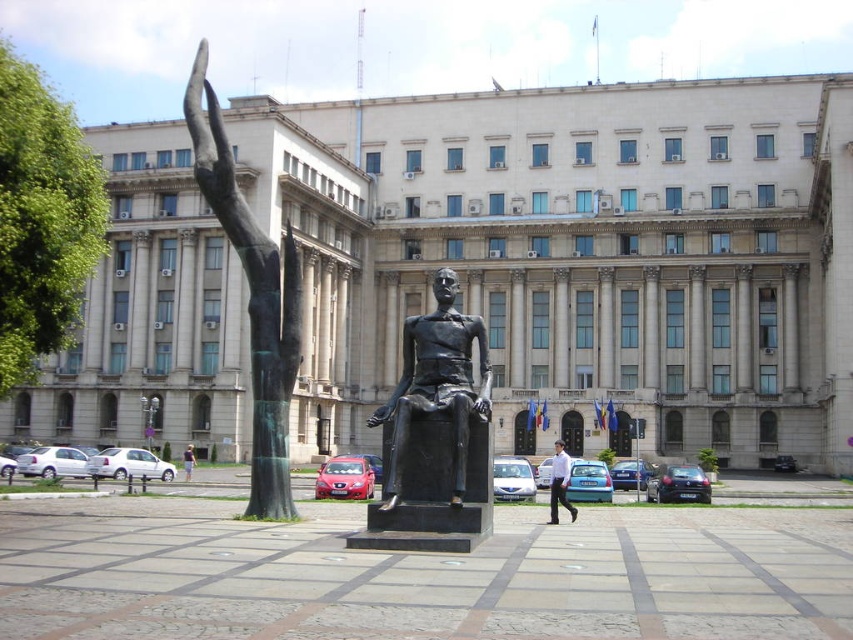
Image resolution: width=853 pixels, height=640 pixels. Describe the element at coordinates (253, 298) in the screenshot. I see `bronze statue at left` at that location.

Where is `bronze statue at left`? bronze statue at left is located at coordinates (253, 298).

What do you see at coordinates (436, 385) in the screenshot? I see `bronze statue at center` at bounding box center [436, 385].

Does bronze statue at center have a smaller size compared to light brown hair at lower left?

No, bronze statue at center is not smaller than light brown hair at lower left.

Find the location of a particular element. bronze statue at center is located at coordinates (436, 385).

Looking at this image, is white shirt at center closer to camera compared to light brown hair at lower left?

Yes.

Measure the distance between point (552, 460) and camera.

224.18 feet

Which is behind, point (556, 497) or point (189, 458)?

Point (189, 458)

Identify the location of white shirt at center. (560, 483).